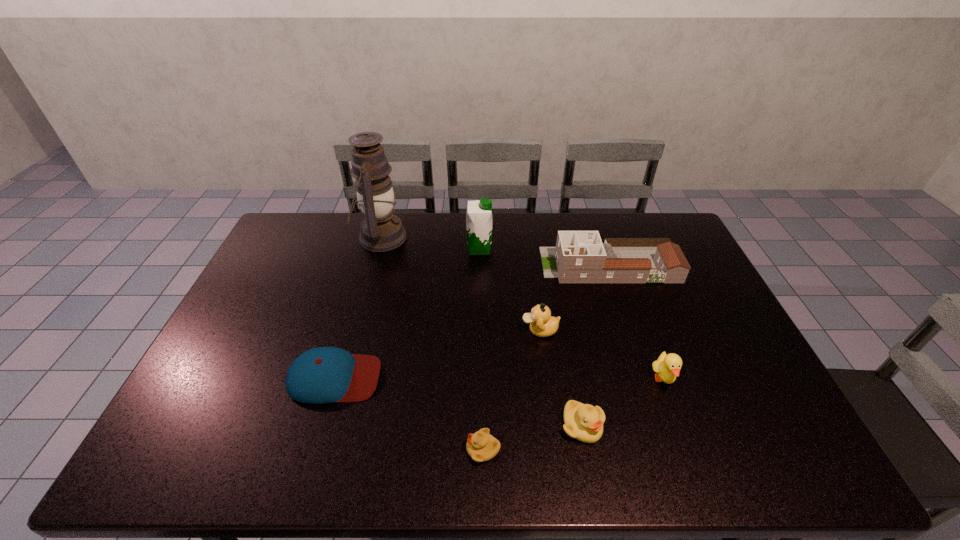
Locate an element on the screen. This screenshot has width=960, height=540. vacant space located 0.100m on the front-facing side of the soya milk is located at coordinates (519, 249).

This screenshot has height=540, width=960. I want to click on vacant space located at the main entrance of the dollhouse, so click(468, 265).

Where is `vacant space located at the main entrance of the dollhouse`? The width and height of the screenshot is (960, 540). vacant space located at the main entrance of the dollhouse is located at coordinates click(x=433, y=265).

This screenshot has height=540, width=960. I want to click on vacant region located at the main entrance of the dollhouse, so click(x=528, y=265).

In order to click on free region located on the face of the fourth farthest object in this screenshot , I will do `click(424, 330)`.

Identify the location of free space located 0.160m on the face of the fourth farthest object. This screenshot has width=960, height=540. (468, 330).

The image size is (960, 540). Find the location of `vacant area located on the face of the fourth farthest object`. vacant area located on the face of the fourth farthest object is located at coordinates pos(444,330).

This screenshot has height=540, width=960. In order to click on vacant space situated on the front-facing side of the second farthest duckling in this screenshot , I will do `click(684, 434)`.

You are a GUI agent. You are given a task and a screenshot of the screen. Output one action in this format:
    pyautogui.click(x=<x>, y=<y>)
    Task: Click on the free space located with the bill of the baseball cap facing forward
    This screenshot has height=540, width=960.
    Given the screenshot: What is the action you would take?
    pyautogui.click(x=507, y=377)

Locate an element on the screen. This screenshot has height=540, width=960. vacant space located on the front-facing side of the leftmost duckling is located at coordinates (390, 449).